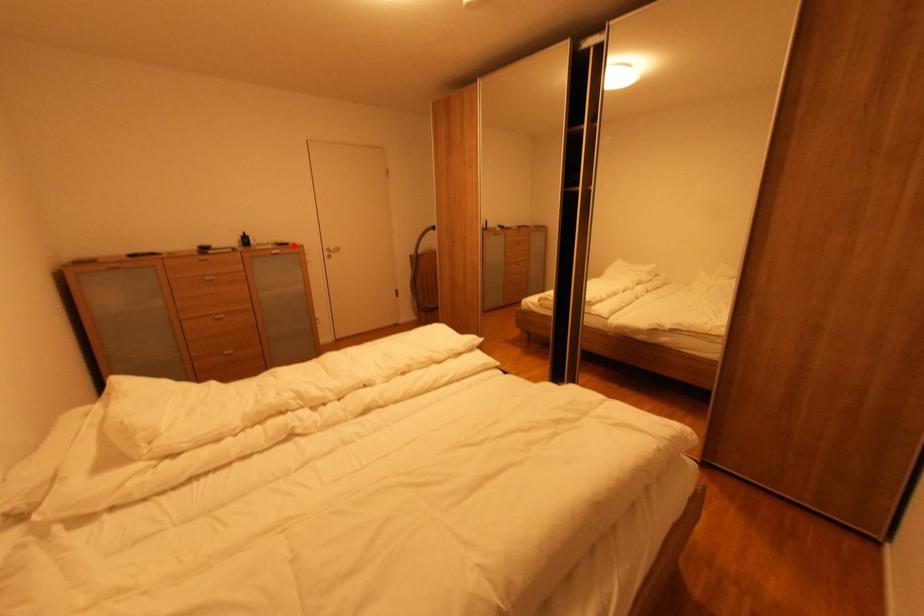
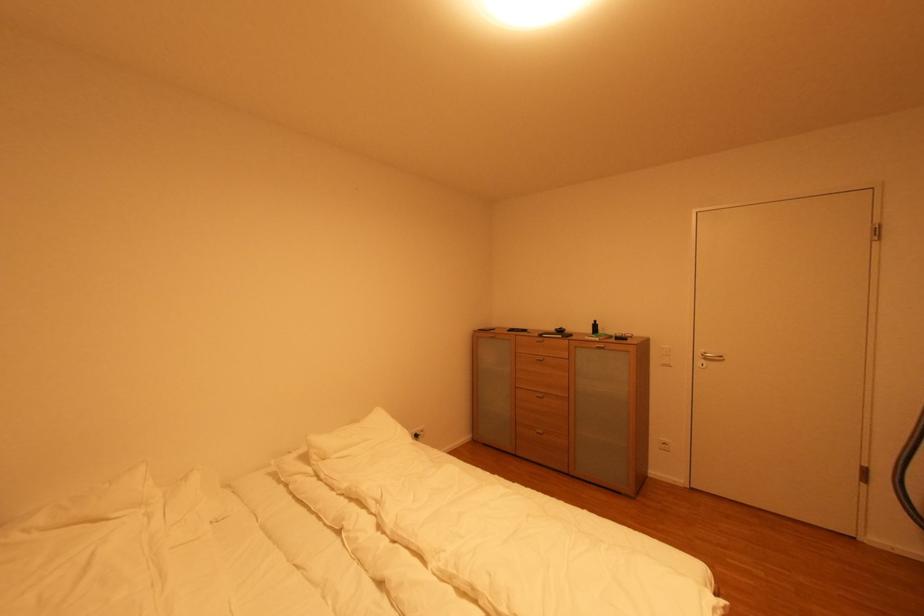
Find the pixel in the second image that matches the highlighted location in the first image.

(630, 339)